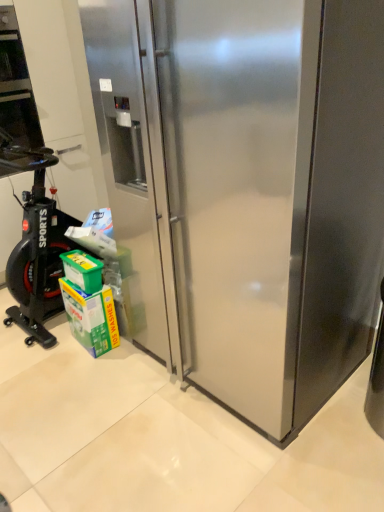
This screenshot has height=512, width=384. Describe the element at coordinates (82, 270) in the screenshot. I see `green plastic box at lower left` at that location.

Image resolution: width=384 pixels, height=512 pixels. I want to click on green plastic box at lower left, so click(x=82, y=270).

Can you tell me how much stainless steel refrigerator at center and green cardboard carton at lower left differ in facing direction?

6.51 degrees.

Considering the sizes of stainless steel refrigerator at center and green cardboard carton at lower left in the image, is stainless steel refrigerator at center wider or thinner than green cardboard carton at lower left?

Considering their sizes, stainless steel refrigerator at center looks broader than green cardboard carton at lower left.

Measure the distance from stainless steel refrigerator at center to green cardboard carton at lower left.

stainless steel refrigerator at center is 33.70 inches from green cardboard carton at lower left.

Are stainless steel refrigerator at center and green cardboard carton at lower left located far from each other?

No, stainless steel refrigerator at center is not far away from green cardboard carton at lower left.

Between green cardboard carton at lower left and green plastic box at lower left, which one appears on the left side from the viewer's perspective?

green plastic box at lower left.

How far apart are green cardboard carton at lower left and green plastic box at lower left?

14.18 centimeters.

Does point (98, 353) come closer to viewer compared to point (98, 266)?

That is False.

Is the position of green cardboard carton at lower left less distant than that of green plastic box at lower left?

No.

Is the position of green plastic box at lower left more distant than that of stainless steel refrigerator at center?

Yes.

Could you tell me if green plastic box at lower left is facing stainless steel refrigerator at center?

No, green plastic box at lower left is not turned towards stainless steel refrigerator at center.

How far apart are green plastic box at lower left and stainless steel refrigerator at center?

green plastic box at lower left and stainless steel refrigerator at center are 36.25 inches apart.

Considering the sizes of green plastic box at lower left and stainless steel refrigerator at center in the image, is green plastic box at lower left taller or shorter than stainless steel refrigerator at center?

In the image, green plastic box at lower left appears to be shorter than stainless steel refrigerator at center.

Can you tell me how much black rubber exercise bike at left and stainless steel refrigerator at center differ in facing direction?

The facing directions of black rubber exercise bike at left and stainless steel refrigerator at center are 89.1 degrees apart.

From a real-world perspective, is black rubber exercise bike at left on top of stainless steel refrigerator at center?

Yes, from a real-world perspective, black rubber exercise bike at left is over stainless steel refrigerator at center

Is black rubber exercise bike at left behind stainless steel refrigerator at center?

Yes, the depth of black rubber exercise bike at left is greater than that of stainless steel refrigerator at center.

Where is `home appliance that appears above the stainless steel refrigerator at center (from the image's perspective)`? home appliance that appears above the stainless steel refrigerator at center (from the image's perspective) is located at coordinates (18, 106).

From the image's perspective, which is above, black rubber exercise bike at left or green plastic box at lower left?

black rubber exercise bike at left, from the image's perspective.

In terms of size, does black rubber exercise bike at left appear bigger or smaller than green plastic box at lower left?

Clearly, black rubber exercise bike at left is larger in size than green plastic box at lower left.

Considering the relative positions of black rubber exercise bike at left and green plastic box at lower left in the image provided, is black rubber exercise bike at left to the left of green plastic box at lower left from the viewer's perspective?

Yes, black rubber exercise bike at left is to the left of green plastic box at lower left.

Who is taller, green cardboard carton at lower left or black rubber exercise bike at left?

Standing taller between the two is black rubber exercise bike at left.

Is the position of green cardboard carton at lower left more distant than that of black rubber exercise bike at left?

No, it is not.

From a real-world perspective, which object rests below the other?

From a 3D spatial view, green cardboard carton at lower left is below.

You are a GUI agent. You are given a task and a screenshot of the screen. Output one action in this format:
    pyautogui.click(x=<x>, y=<y>)
    Task: Click on the refrigerator that appears in front of the green plastic box at lower left
    
    Given the screenshot: What is the action you would take?
    pyautogui.click(x=270, y=196)

From the image's perspective, is stainless steel refrigerator at center located above or below green plastic box at lower left?

stainless steel refrigerator at center is situated higher than green plastic box at lower left in the image.

Is stainless steel refrigerator at center turned away from green plastic box at lower left?

→ No, stainless steel refrigerator at center's orientation is not away from green plastic box at lower left.

Measure the distance from stainless steel refrigerator at center to green plastic box at lower left.

A distance of 36.25 inches exists between stainless steel refrigerator at center and green plastic box at lower left.

Identify the location of refrigerator above the green cardboard carton at lower left (from the image's perspective). (270, 196).

Identify the location of carton behind the green plastic box at lower left. (91, 317).

Estimate the real-world distances between objects in this image. Which object is further from green plastic box at lower left, black rubber exercise bike at left or green cardboard carton at lower left?

black rubber exercise bike at left.

When comparing their distances from green plastic box at lower left, does green cardboard carton at lower left or black rubber exercise bike at left seem further?

black rubber exercise bike at left lies further to green plastic box at lower left than the other object.

From the image, which object appears to be farther from stainless steel refrigerator at center, black rubber exercise bike at left or green cardboard carton at lower left?

Among the two, black rubber exercise bike at left is located further to stainless steel refrigerator at center.

When comparing their distances from green cardboard carton at lower left, does green plastic box at lower left or stainless steel refrigerator at center seem closer?

Based on the image, green plastic box at lower left appears to be nearer to green cardboard carton at lower left.

Which object lies further to the anchor point black rubber exercise bike at left, green plastic box at lower left or green cardboard carton at lower left?

The object further to black rubber exercise bike at left is green cardboard carton at lower left.

Which object lies nearer to the anchor point stainless steel refrigerator at center, black rubber exercise bike at left or green plastic box at lower left?

The object closer to stainless steel refrigerator at center is green plastic box at lower left.

Looking at the image, which one is located closer to green cardboard carton at lower left, green plastic box at lower left or black rubber exercise bike at left?

Among the two, green plastic box at lower left is located nearer to green cardboard carton at lower left.

Estimate the real-world distances between objects in this image. Which object is further from stainless steel refrigerator at center, green cardboard carton at lower left or black rubber exercise bike at left?

black rubber exercise bike at left.

Locate an element on the screen. carton between black rubber exercise bike at left and stainless steel refrigerator at center in the horizontal direction is located at coordinates (91, 317).

This screenshot has height=512, width=384. Find the location of `box between black rubber exercise bike at left and stainless steel refrigerator at center from left to right`. box between black rubber exercise bike at left and stainless steel refrigerator at center from left to right is located at coordinates (82, 270).

Locate an element on the screen. The image size is (384, 512). box between stainless steel refrigerator at center and green cardboard carton at lower left from front to back is located at coordinates (82, 270).

The width and height of the screenshot is (384, 512). In order to click on box between black rubber exercise bike at left and green cardboard carton at lower left in the up-down direction in this screenshot , I will do `click(82, 270)`.